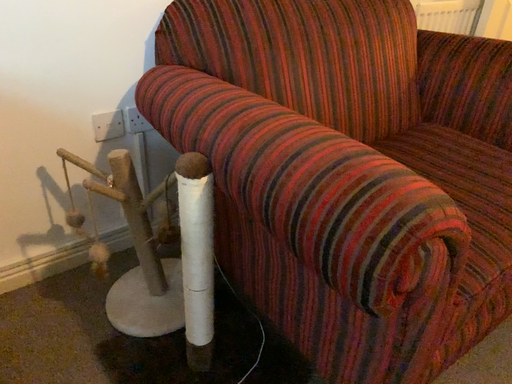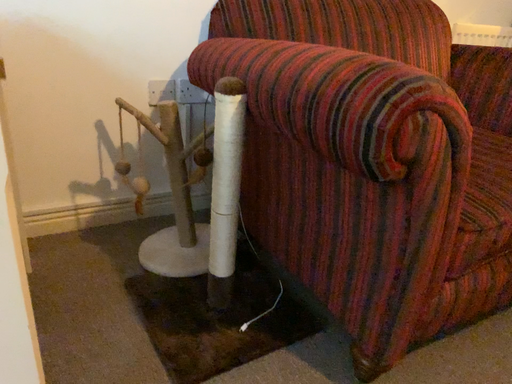
Question: Which way did the camera rotate in the video?

Choices:
 (A) rotated downward
 (B) rotated upward

Answer: (B)